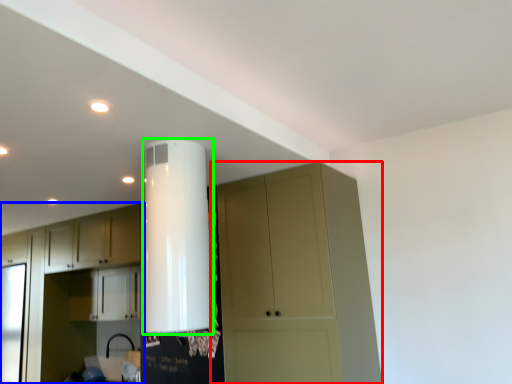
Question: Considering the real-world distances, which object is closest to cupboard (highlighted by a red box)? cabinetry (highlighted by a blue box) or water heater (highlighted by a green box).

Choices:
 (A) cabinetry
 (B) water heater

Answer: (B)